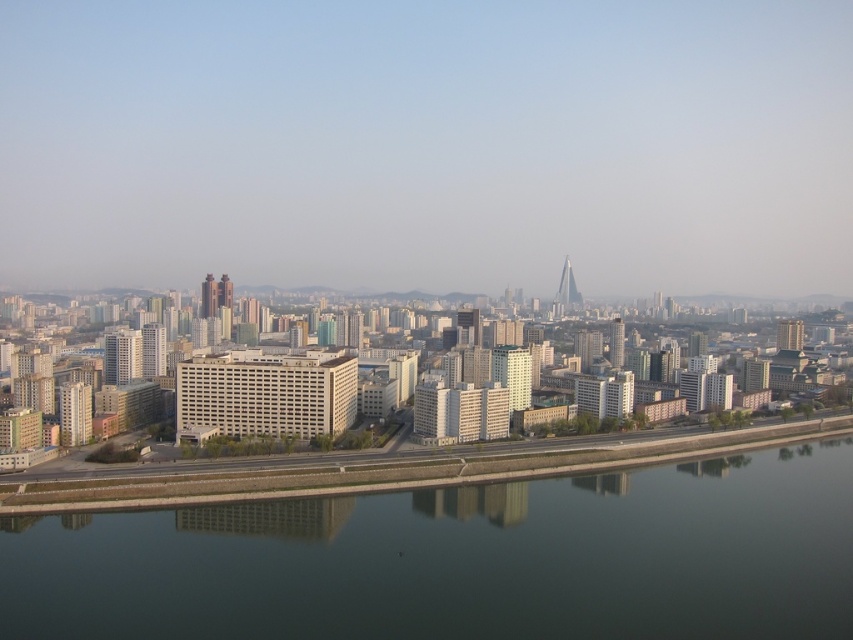
You are standing at the center of the cityscape and want to locate the matte gray building at lower left. According to its 2D coordinates, where should you look relative to your position?

The matte gray building at lower left is located at coordinates point (74, 413), which means it is positioned to the lower left of your current viewpoint.

You are standing at the point with coordinates (461, 561) in the cityscape. What is the feature at this location?

The green reflective water at center is located at point (461, 561).